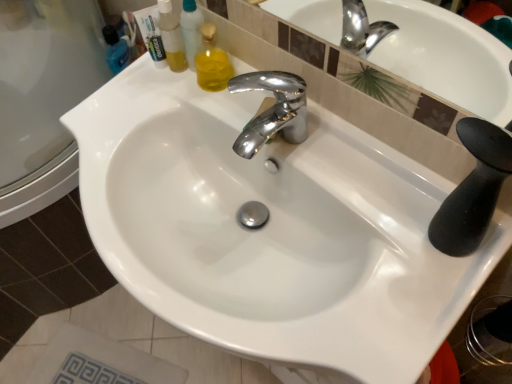
Question: From the image's perspective, relative to translucent plastic bottle at upper left, is chrome metallic faucet at center above or below?

Choices:
 (A) below
 (B) above

Answer: (A)

Question: Do you think chrome metallic faucet at center is within translucent plastic bottle at upper left, or outside of it?

Choices:
 (A) inside
 (B) outside

Answer: (B)

Question: From a real-world perspective, relative to translucent plastic bottle at upper left, is chrome metallic faucet at center vertically above or below?

Choices:
 (A) above
 (B) below

Answer: (B)

Question: In the image, is translucent plastic bottle at upper left on the left side or the right side of chrome metallic faucet at center?

Choices:
 (A) left
 (B) right

Answer: (A)

Question: Considering the positions of point (165, 57) and point (254, 76), is point (165, 57) closer or farther from the camera than point (254, 76)?

Choices:
 (A) farther
 (B) closer

Answer: (A)

Question: Is translucent plastic bottle at upper left bigger or smaller than chrome metallic faucet at center?

Choices:
 (A) big
 (B) small

Answer: (A)

Question: From their relative heights in the image, would you say translucent plastic bottle at upper left is taller or shorter than chrome metallic faucet at center?

Choices:
 (A) tall
 (B) short

Answer: (A)